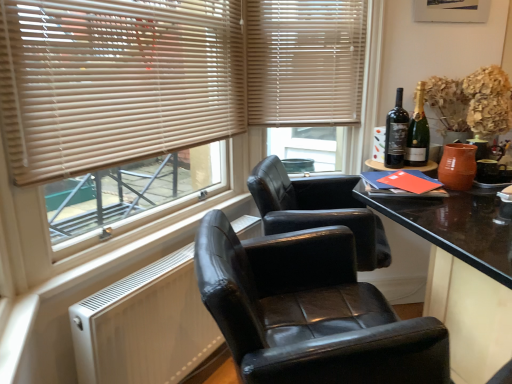
Question: Considering the relative sizes of black leather chair at center and black glass bottle at upper right, acting as the first bottle starting from the left, in the image provided, is black leather chair at center smaller than black glass bottle at upper right, acting as the first bottle starting from the left,?

Choices:
 (A) no
 (B) yes

Answer: (A)

Question: Can you confirm if black leather chair at center is wider than black glass bottle at upper right, acting as the first bottle starting from the left?

Choices:
 (A) no
 (B) yes

Answer: (B)

Question: Is black leather chair at center thinner than black glass bottle at upper right, placed as the 2th bottle when sorted from right to left?

Choices:
 (A) no
 (B) yes

Answer: (A)

Question: Is black glass bottle at upper right, placed as the 2th bottle when sorted from right to left, at the back of black leather chair at center?

Choices:
 (A) no
 (B) yes

Answer: (A)

Question: Is black leather chair at center surrounding black glass bottle at upper right, placed as the 2th bottle when sorted from right to left?

Choices:
 (A) yes
 (B) no

Answer: (B)

Question: Relative to black leather chair at center, is beige wood blinds at upper left in front or behind?

Choices:
 (A) front
 (B) behind

Answer: (B)

Question: In terms of width, does beige wood blinds at upper left look wider or thinner when compared to black leather chair at center?

Choices:
 (A) thin
 (B) wide

Answer: (A)

Question: From a real-world perspective, is beige wood blinds at upper left above or below black leather chair at center?

Choices:
 (A) below
 (B) above

Answer: (B)

Question: Based on their positions, is beige wood blinds at upper left located to the left or right of black leather chair at center?

Choices:
 (A) left
 (B) right

Answer: (A)

Question: Visually, is black leather chair at center positioned to the left or to the right of beige wood blinds at upper left?

Choices:
 (A) left
 (B) right

Answer: (B)

Question: From the image's perspective, is black leather chair at center positioned above or below beige wood blinds at upper left?

Choices:
 (A) below
 (B) above

Answer: (A)

Question: Considering the positions of point (324, 235) and point (311, 74), is point (324, 235) closer or farther from the camera than point (311, 74)?

Choices:
 (A) closer
 (B) farther

Answer: (A)

Question: From a real-world perspective, relative to beige wood blinds at upper left, is black leather chair at center vertically above or below?

Choices:
 (A) below
 (B) above

Answer: (A)

Question: Based on their positions, is black glass bottle at upper right, placed as the 2th bottle when sorted from right to left, located to the left or right of beige wood blinds at upper left?

Choices:
 (A) right
 (B) left

Answer: (A)

Question: Is black glass bottle at upper right, acting as the first bottle starting from the left, taller or shorter than beige wood blinds at upper left?

Choices:
 (A) short
 (B) tall

Answer: (A)